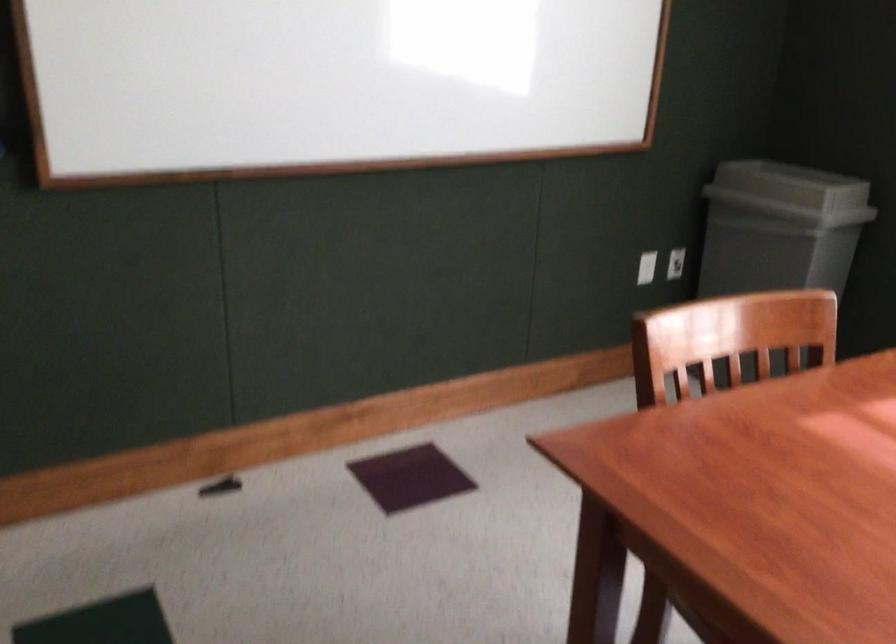
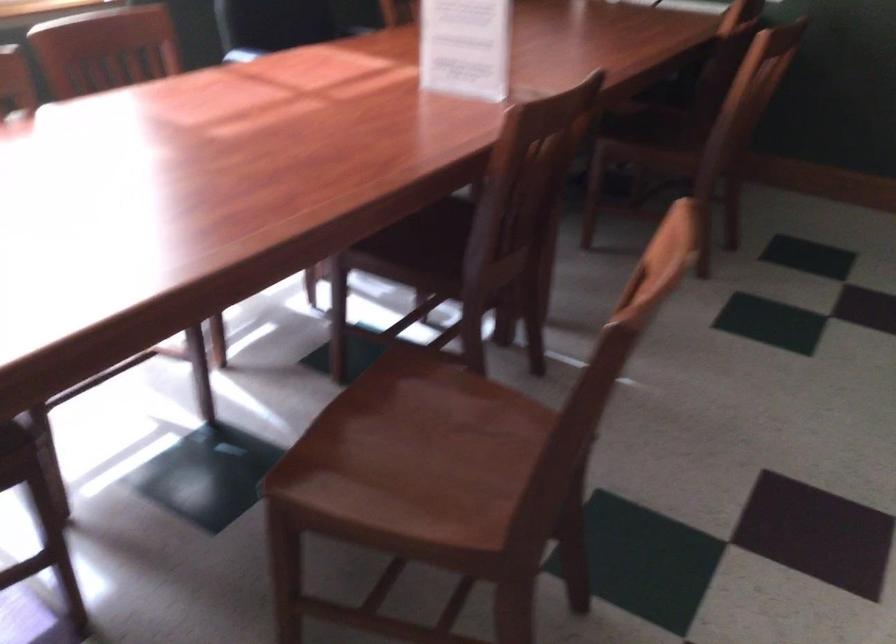
Based on the continuous images, in which direction is the camera rotating?

The rotation direction of the camera is right-down.